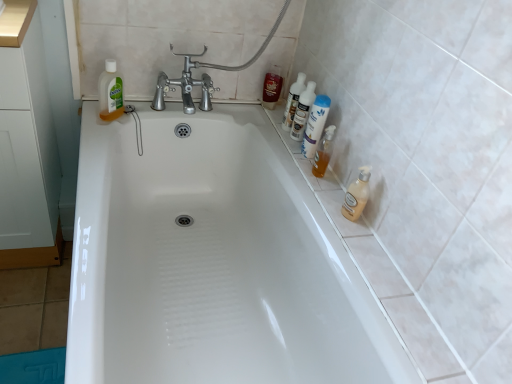
Question: Visually, is translucent plastic bottle at upper left, acting as the 4th cleaning product starting from the right, positioned to the left or to the right of white glossy bathtub at center?

Choices:
 (A) right
 (B) left

Answer: (B)

Question: From the image's perspective, relative to white glossy bathtub at center, is translucent plastic bottle at upper left, the first cleaning product when ordered from left to right, above or below?

Choices:
 (A) above
 (B) below

Answer: (A)

Question: Which is farther from the translucent plastic bottle at upper right, the 3th cleaning product when ordered from left to right?

Choices:
 (A) translucent plastic bottles at upper right, the 2th cleaning product positioned from the left
 (B) white glossy bathtub at center
 (C) translucent plastic bottle at right, which is the 3th toiletry from top to bottom
 (D) white matte cabinet at left
 (E) translucent plastic bottle at upper left, acting as the 4th cleaning product starting from the right

Answer: (D)

Question: Based on their relative distances, which object is farther from the translucent plastic bottle at right, the 1th toiletry positioned from the right?

Choices:
 (A) translucent beige pump bottle at right, which is counted as the 1th cleaning product, starting from the right
 (B) white matte cabinet at left
 (C) white glossy bottles at upper right, the 2th toiletry from the top
 (D) translucent plastic bottle at upper left, acting as the 4th cleaning product starting from the right
 (E) shiny red can at upper right, which is counted as the 1th toiletry, starting from the top

Answer: (B)